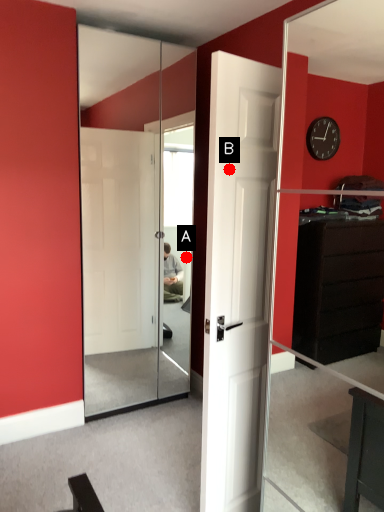
Question: Two points are circled on the image, labeled by A and B beside each circle. Which point is farther from the camera taking this photo?

Choices:
 (A) A is further
 (B) B is further

Answer: (A)